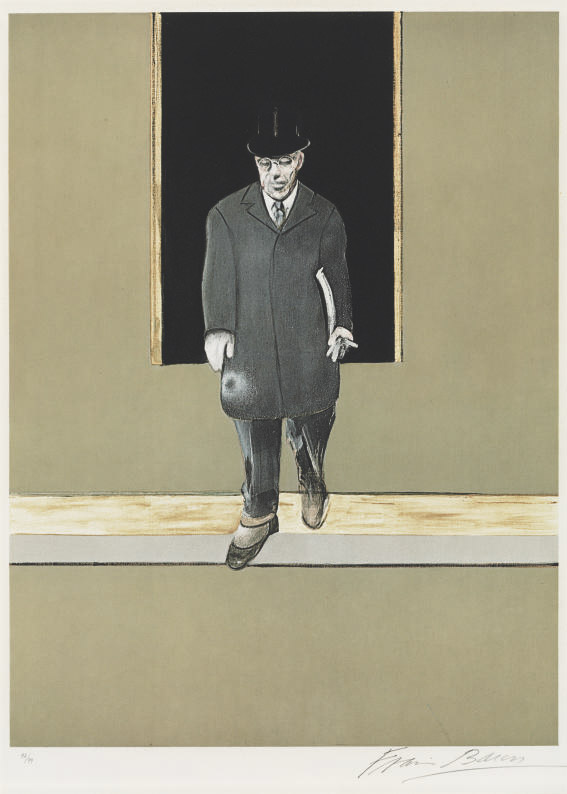
Identify the location of shoe. (253, 538).